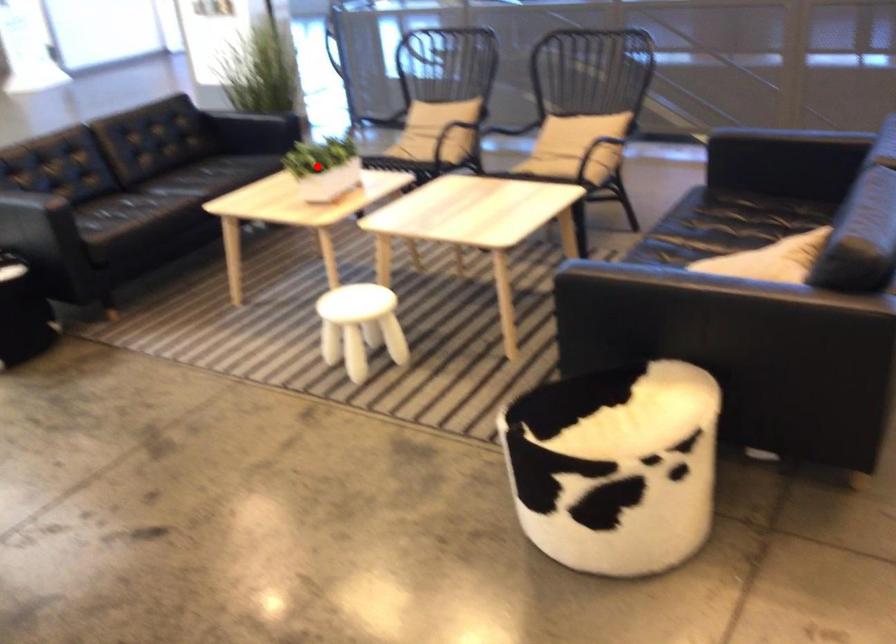
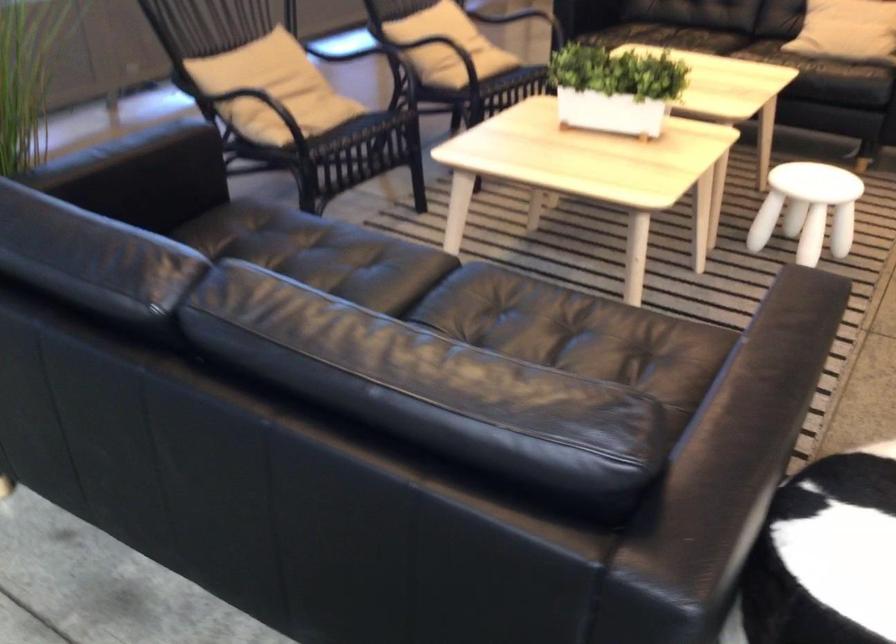
Where in the second image is the point corresponding to the highlighted location from the first image?

(615, 88)